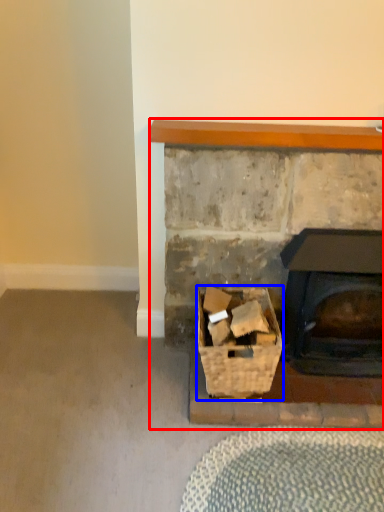
Question: Which object appears farthest to the camera in this image, fireplace (highlighted by a red box) or basket (highlighted by a blue box)?

Choices:
 (A) fireplace
 (B) basket

Answer: (A)